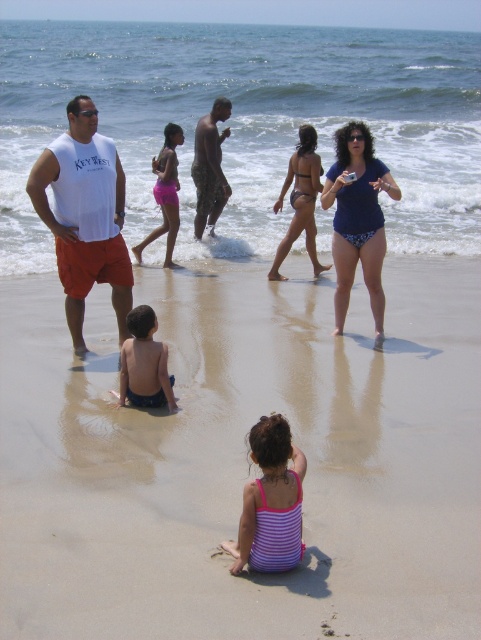
Question: Does blue printed bikini at center appear under matte bikini at center?

Choices:
 (A) no
 (B) yes

Answer: (B)

Question: Does light brown skin at center appear over matte bikini at center?

Choices:
 (A) yes
 (B) no

Answer: (B)

Question: Which point appears farthest from the camera in this image?

Choices:
 (A) (227, 128)
 (B) (111, 172)
 (C) (165, 529)
 (D) (174, 170)

Answer: (A)

Question: Is white sleeveless shirt at left smaller than matte bikini at center?

Choices:
 (A) no
 (B) yes

Answer: (A)

Question: Estimate the real-world distances between objects in this image. Which object is farther from the camouflage pants at center?

Choices:
 (A) light brown skin at center
 (B) blue printed bikini at center

Answer: (A)

Question: Which of these objects is positioned farthest from the pink fabric shorts at center?

Choices:
 (A) blue printed bikini at center
 (B) light brown skin at center
 (C) purple striped swimsuit at center
 (D) camouflage pants at center

Answer: (C)